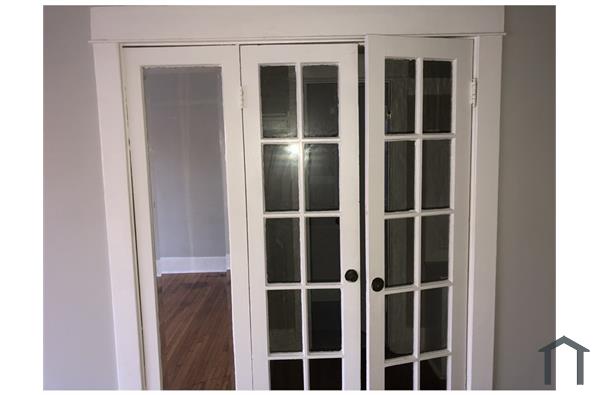
Locate an element on the screen. knob is located at coordinates (350, 276).